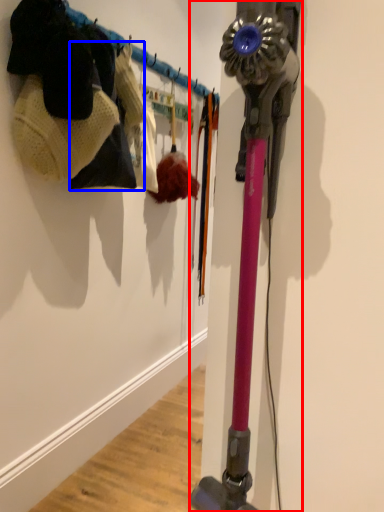
Question: Which of the following is the closest to the observer, vacuum (highlighted by a red box) or clothing (highlighted by a blue box)?

Choices:
 (A) vacuum
 (B) clothing

Answer: (A)